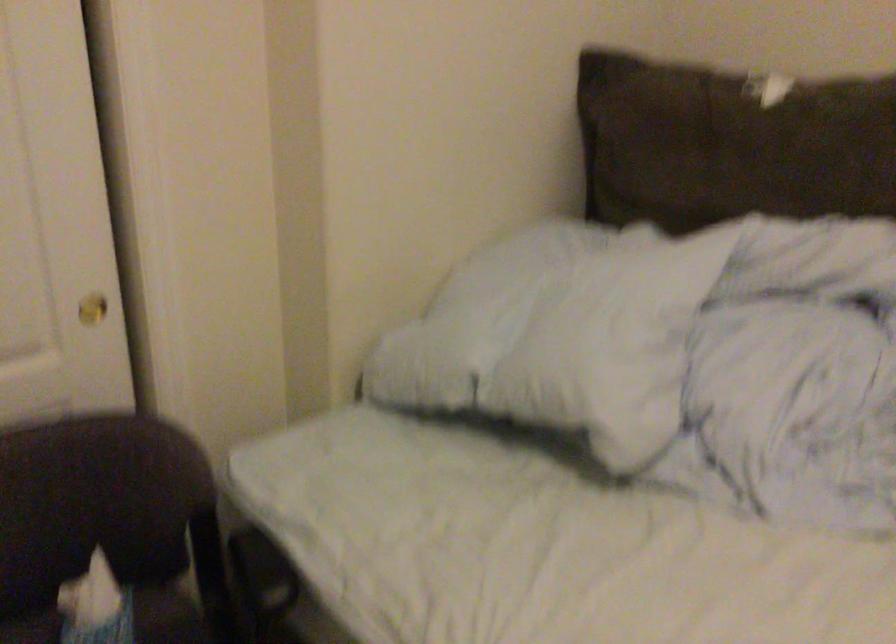
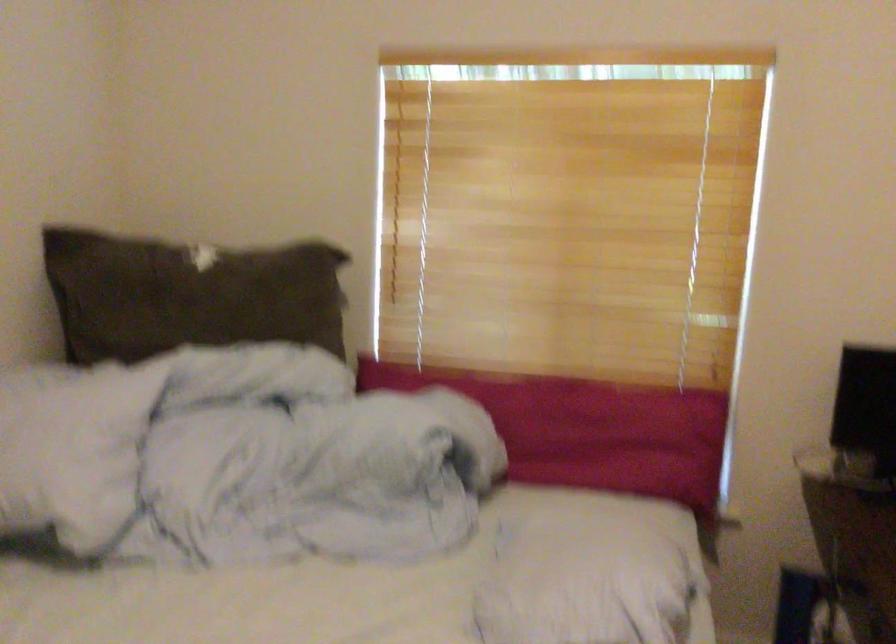
Question: The camera is either moving clockwise (left) or counter-clockwise (right) around the object. The first image is from the beginning of the video and the second image is from the end. Is the camera moving left or right when shooting the video?

Choices:
 (A) Left
 (B) Right

Answer: (A)